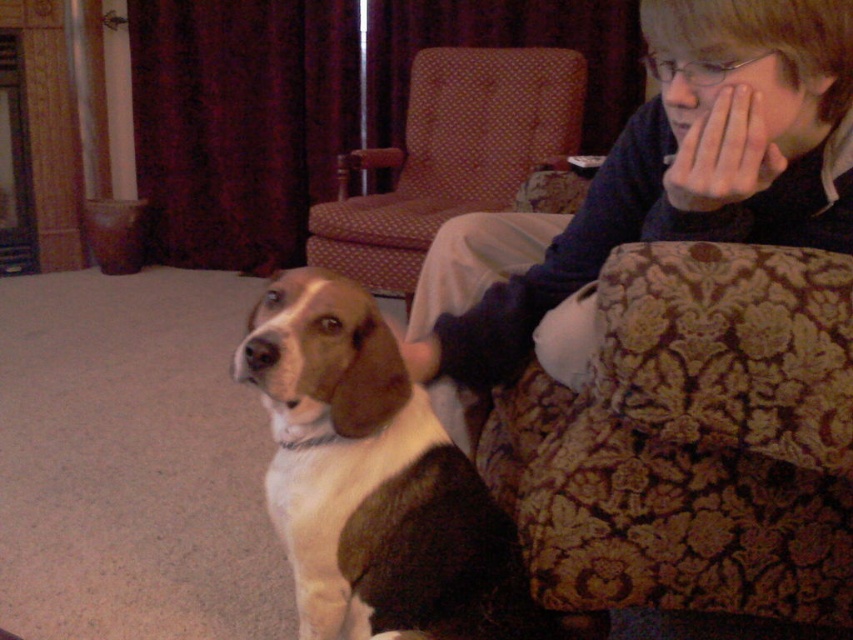
Question: In this image, where is matte blue sweater at upper right located relative to patterned fabric armchair at center?

Choices:
 (A) below
 (B) above

Answer: (A)

Question: Estimate the real-world distances between objects in this image. Which object is farther from the tri-color fur dog at center?

Choices:
 (A) patterned fabric armchair at center
 (B) floral fabric couch at lower right
 (C) matte blue sweater at upper right

Answer: (A)

Question: Does matte blue sweater at upper right have a lesser width compared to patterned fabric armchair at center?

Choices:
 (A) no
 (B) yes

Answer: (B)

Question: Estimate the real-world distances between objects in this image. Which object is farther from the tri-color fur dog at center?

Choices:
 (A) matte blue sweater at upper right
 (B) patterned fabric armchair at center
 (C) floral fabric couch at lower right

Answer: (B)

Question: Is floral fabric couch at lower right positioned at the back of patterned fabric armchair at center?

Choices:
 (A) no
 (B) yes

Answer: (A)

Question: Which object is positioned closest to the patterned fabric armchair at center?

Choices:
 (A) tri-color fur dog at center
 (B) matte blue sweater at upper right
 (C) floral fabric couch at lower right

Answer: (B)